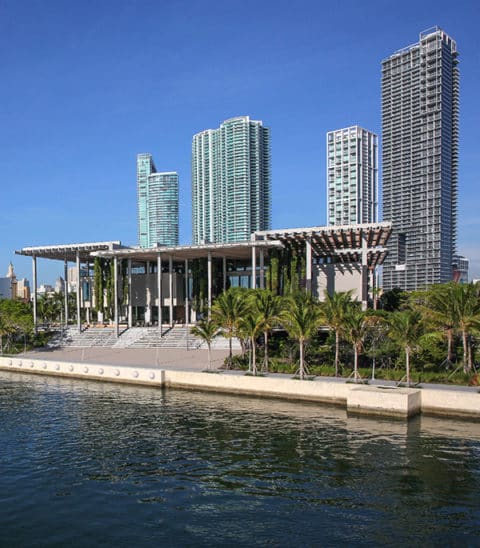
The height and width of the screenshot is (548, 480). Find the location of `tan wall`. tan wall is located at coordinates (310, 393), (237, 383).